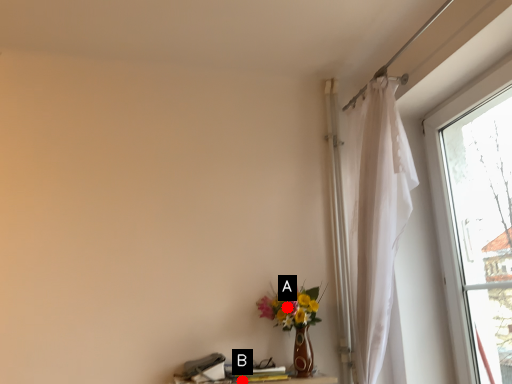
Question: Two points are circled on the image, labeled by A and B beside each circle. Among these points, which one is nearest to the camera?

Choices:
 (A) A is closer
 (B) B is closer

Answer: (B)